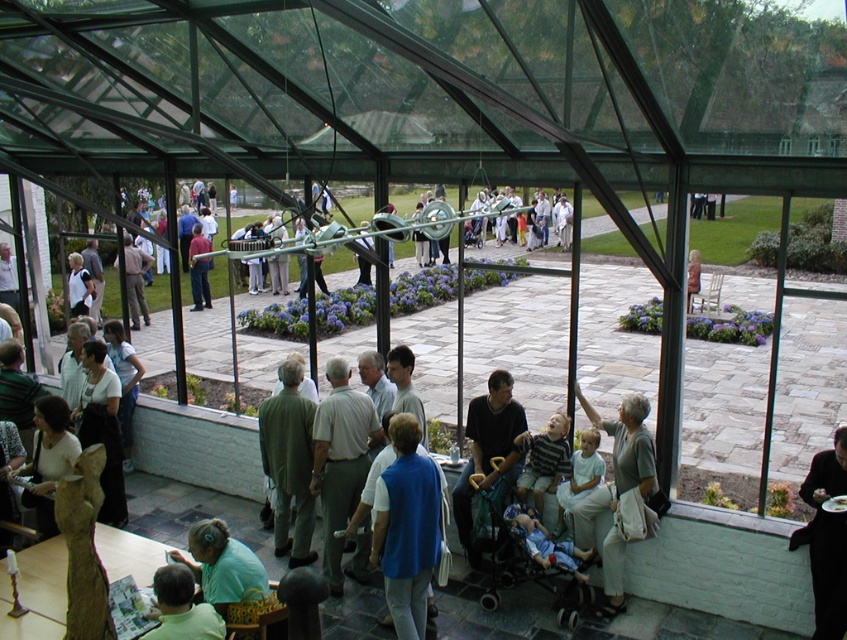
You are at the conservatory and notice two people wearing the blue fabric vest at center and matte gray pants at center. Which clothing item is shorter in height?

The blue fabric vest at center is shorter in height than the matte gray pants at center because it is not as tall as the matte gray pants at center.

You are a photographer standing in the conservatory and want to capture a photo of the light gray pants at lower right and the light blue fabric at lower center. Which object should you focus on first if you want to include both in the frame without moving the camera?

You should focus on the light blue fabric at lower center first because it is lower in the frame than the light gray pants at lower right, which is positioned above it. This way, both objects will be included in the frame.

You are standing at the entrance of the conservatory and see two points marked in the scene. The first point is at coordinates point (462, 472) and the second is at point (148, 630). Which point is closer to you?

Point (148, 630) is closer to you because it is nearer to the camera compared to point (462, 472), which is further away.